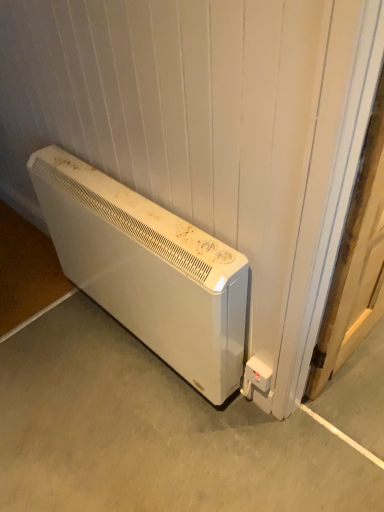
Identify the location of vacant space situated above white matte heater at lower left (from a real-world perspective). This screenshot has width=384, height=512. (93, 367).